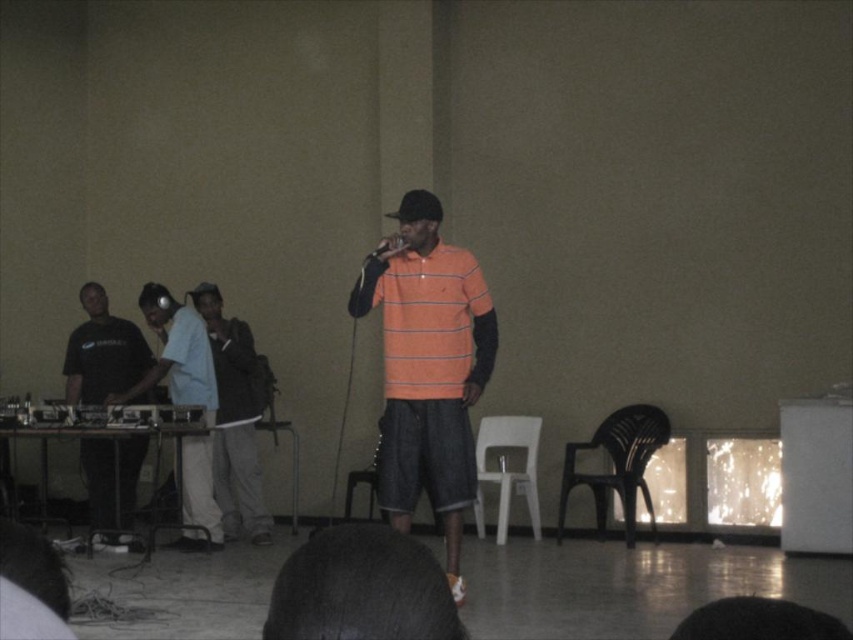
You are organizing a small event in this venue and need to place a light blue denim jacket at center and a plastic chair at center. Since both items are at the center, which one should you place first to ensure they fit properly?

The light blue denim jacket at center is wider than the plastic chair at center, so you should place the light blue denim jacket at center first to ensure there is enough space for both items.

Based on the photo, you are an event organizer who needs to decide whether to place a large banner behind the light blue denim jacket at center and the plastic chair at center. Since the banner needs to be tall enough to cover both objects, which object determines the minimum height required for the banner?

The light blue denim jacket at center is much taller than the plastic chair at center, so the banner must be at least as tall as the light blue denim jacket at center to cover both.

You are a photographer standing behind the camera. You want to hand the light blue denim jacket at center to the person on stage without moving the camera. Can you reach the jacket from your current position?

The light blue denim jacket at center and camera are 22.82 feet apart, so you cannot reach the jacket from the camera position without moving.